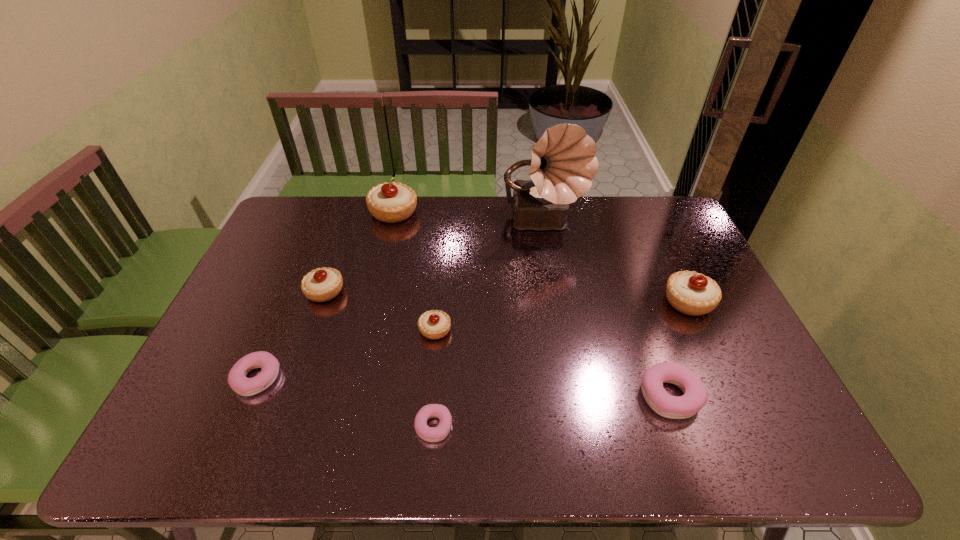
Where is `the third shortest pastry`? the third shortest pastry is located at coordinates (695, 396).

This screenshot has height=540, width=960. I want to click on the third shortest object, so click(x=695, y=396).

At what (x,y) coordinates should I click in order to perform the action: click on the second biggest pink pastry. Please return your answer as a coordinate pair (x, y). This screenshot has width=960, height=540. Looking at the image, I should click on (269, 365).

You are a GUI agent. You are given a task and a screenshot of the screen. Output one action in this format:
    pyautogui.click(x=<x>, y=<y>)
    Task: Click on the seventh tallest object
    This screenshot has width=960, height=540.
    Given the screenshot: What is the action you would take?
    pyautogui.click(x=269, y=365)

This screenshot has height=540, width=960. Find the location of `the second pink pastry from right to left`. the second pink pastry from right to left is located at coordinates (431, 434).

I want to click on the smallest pink pastry, so click(x=431, y=434).

The height and width of the screenshot is (540, 960). In order to click on vacant space located from the horn of the tallest object in this screenshot , I will do `click(564, 345)`.

Where is `free spot located 0.120m on the left of the tallest pastry`? free spot located 0.120m on the left of the tallest pastry is located at coordinates (336, 212).

You are a GUI agent. You are given a task and a screenshot of the screen. Output one action in this format:
    pyautogui.click(x=<x>, y=<y>)
    Task: Click on the free location located 0.320m on the left of the second biggest beige pastry
    Image resolution: width=960 pixels, height=540 pixels.
    Given the screenshot: What is the action you would take?
    pyautogui.click(x=554, y=301)

This screenshot has width=960, height=540. Identify the location of vacant space located on the front of the third biggest beige pastry. (313, 325).